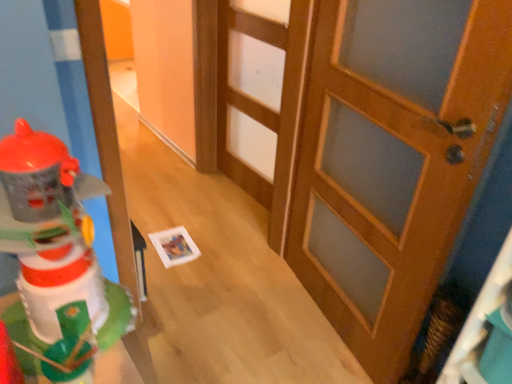
The height and width of the screenshot is (384, 512). What do you see at coordinates (393, 159) in the screenshot?
I see `wooden door at center, which is counted as the 2th door, starting from the left` at bounding box center [393, 159].

Image resolution: width=512 pixels, height=384 pixels. What do you see at coordinates (55, 260) in the screenshot? I see `plastic toy robot at left` at bounding box center [55, 260].

The height and width of the screenshot is (384, 512). I want to click on wooden door at center, arranged as the 1th door when viewed from the right, so click(393, 159).

Does wooden door at center, the 2th door positioned from the front, turn towards plastic toy robot at left?

No, wooden door at center, the 2th door positioned from the front, is not oriented towards plastic toy robot at left.

Can you confirm if wooden door at center, the second door viewed from the right, is bigger than plastic toy robot at left?

Yes.

Which is in front, wooden door at center, the 2th door positioned from the front, or plastic toy robot at left?

plastic toy robot at left is more forward.

Considering the relative sizes of wooden door at center, the second door viewed from the right, and wooden door at center, arranged as the 1th door when viewed from the right, in the image provided, is wooden door at center, the second door viewed from the right, taller than wooden door at center, arranged as the 1th door when viewed from the right,?

Incorrect, the height of wooden door at center, the second door viewed from the right, is not larger of that of wooden door at center, arranged as the 1th door when viewed from the right.

From the image's perspective, is wooden door at center, the 1th door from the back, located above wooden door at center, placed as the 2th door when sorted from back to front?

Yes.

Which object is thinner, wooden door at center, the second door viewed from the right, or wooden door at center, which is counted as the 2th door, starting from the left?

Thinner between the two is wooden door at center, the second door viewed from the right.

Is wooden door at center, the first door in the front-to-back sequence, inside wooden door at center, the 1th door from the back?

Actually, wooden door at center, the first door in the front-to-back sequence, is outside wooden door at center, the 1th door from the back.

Is plastic toy robot at left located within wooden door at center, arranged as the 1th door when viewed from the right?

No, wooden door at center, arranged as the 1th door when viewed from the right, does not contain plastic toy robot at left.

Relative to plastic toy robot at left, is wooden door at center, the first door in the front-to-back sequence, in front or behind?

Visually, wooden door at center, the first door in the front-to-back sequence, is located behind plastic toy robot at left.

Is point (379, 102) behind point (106, 195)?

That is True.

From the image's perspective, is wooden door at center, the first door in the front-to-back sequence, under plastic toy robot at left?

Actually, wooden door at center, the first door in the front-to-back sequence, appears above plastic toy robot at left in the image.

Visually, is plastic toy robot at left positioned to the left or to the right of wooden door at center, which is counted as the 2th door, starting from the left?

plastic toy robot at left is positioned on wooden door at center, which is counted as the 2th door, starting from the left,'s left side.

Is plastic toy robot at left situated inside wooden door at center, placed as the 2th door when sorted from back to front, or outside?

plastic toy robot at left is not enclosed by wooden door at center, placed as the 2th door when sorted from back to front.

From the image's perspective, is plastic toy robot at left located above wooden door at center, arranged as the 1th door when viewed from the right?

No, from the image's perspective, plastic toy robot at left is not over wooden door at center, arranged as the 1th door when viewed from the right.

The image size is (512, 384). I want to click on door that is the 1st object located behind the plastic toy robot at left, so click(393, 159).

Which of these two, wooden door at center, the first door in the front-to-back sequence, or wooden door at center, the second door viewed from the right, stands shorter?

With less height is wooden door at center, the second door viewed from the right.

From a real-world perspective, is wooden door at center, placed as the 2th door when sorted from back to front, below wooden door at center, the second door viewed from the right?

Incorrect, from a real-world perspective, wooden door at center, placed as the 2th door when sorted from back to front, is higher than wooden door at center, the second door viewed from the right.

Considering the relative sizes of wooden door at center, arranged as the 1th door when viewed from the right, and wooden door at center, the 1th door from the back, in the image provided, is wooden door at center, arranged as the 1th door when viewed from the right, smaller than wooden door at center, the 1th door from the back,?

Actually, wooden door at center, arranged as the 1th door when viewed from the right, might be larger than wooden door at center, the 1th door from the back.

How distant is wooden door at center, the first door in the front-to-back sequence, from wooden door at center, the 2th door positioned from the front?

wooden door at center, the first door in the front-to-back sequence, is 22.83 inches away from wooden door at center, the 2th door positioned from the front.

Is there a large distance between plastic toy robot at left and wooden door at center, the 2th door positioned from the front?

Yes, plastic toy robot at left and wooden door at center, the 2th door positioned from the front, are located far from each other.

Considering the sizes of plastic toy robot at left and wooden door at center, the 1th door viewed from the left, in the image, is plastic toy robot at left wider or thinner than wooden door at center, the 1th door viewed from the left,?

Clearly, plastic toy robot at left has more width compared to wooden door at center, the 1th door viewed from the left.

Between plastic toy robot at left and wooden door at center, the second door viewed from the right, which one is positioned behind?

Positioned behind is wooden door at center, the second door viewed from the right.

You are a GUI agent. You are given a task and a screenshot of the screen. Output one action in this format:
    pyautogui.click(x=<x>, y=<y>)
    Task: Click on the door that is the 2nd one when counting upward from the plastic toy robot at left (from the image's perspective)
    The image size is (512, 384).
    Given the screenshot: What is the action you would take?
    pyautogui.click(x=261, y=92)

Locate an element on the screen. toy above the wooden door at center, the 2th door positioned from the front (from a real-world perspective) is located at coordinates (55, 260).

Identify the location of door lying on the left of wooden door at center, arranged as the 1th door when viewed from the right. Image resolution: width=512 pixels, height=384 pixels. (261, 92).

Which object lies further to the anchor point wooden door at center, which is counted as the 2th door, starting from the left, wooden door at center, the 1th door viewed from the left, or plastic toy robot at left?

Based on the image, plastic toy robot at left appears to be further to wooden door at center, which is counted as the 2th door, starting from the left.

Which object lies further to the anchor point plastic toy robot at left, wooden door at center, the first door in the front-to-back sequence, or wooden door at center, the 2th door positioned from the front?

Based on the image, wooden door at center, the 2th door positioned from the front, appears to be further to plastic toy robot at left.

Looking at this image, estimate the real-world distances between objects in this image. Which object is closer to wooden door at center, the second door viewed from the right, plastic toy robot at left or wooden door at center, arranged as the 1th door when viewed from the right?

wooden door at center, arranged as the 1th door when viewed from the right.

From the image, which object appears to be farther from wooden door at center, the 1th door from the back, wooden door at center, which is counted as the 2th door, starting from the left, or plastic toy robot at left?

plastic toy robot at left lies further to wooden door at center, the 1th door from the back, than the other object.

Based on their spatial positions, is plastic toy robot at left or wooden door at center, the 2th door positioned from the front, further from wooden door at center, placed as the 2th door when sorted from back to front?

plastic toy robot at left.

Estimate the real-world distances between objects in this image. Which object is further from plastic toy robot at left, wooden door at center, the 1th door viewed from the left, or wooden door at center, placed as the 2th door when sorted from back to front?

wooden door at center, the 1th door viewed from the left, is positioned further to the anchor plastic toy robot at left.

Locate an element on the screen. Image resolution: width=512 pixels, height=384 pixels. door between plastic toy robot at left and wooden door at center, the 1th door from the back, from front to back is located at coordinates (393, 159).